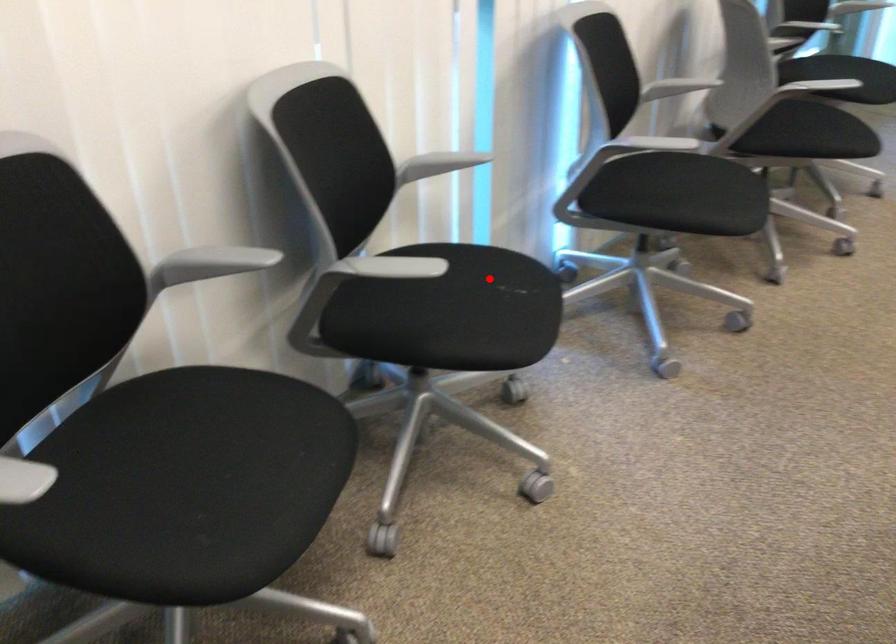
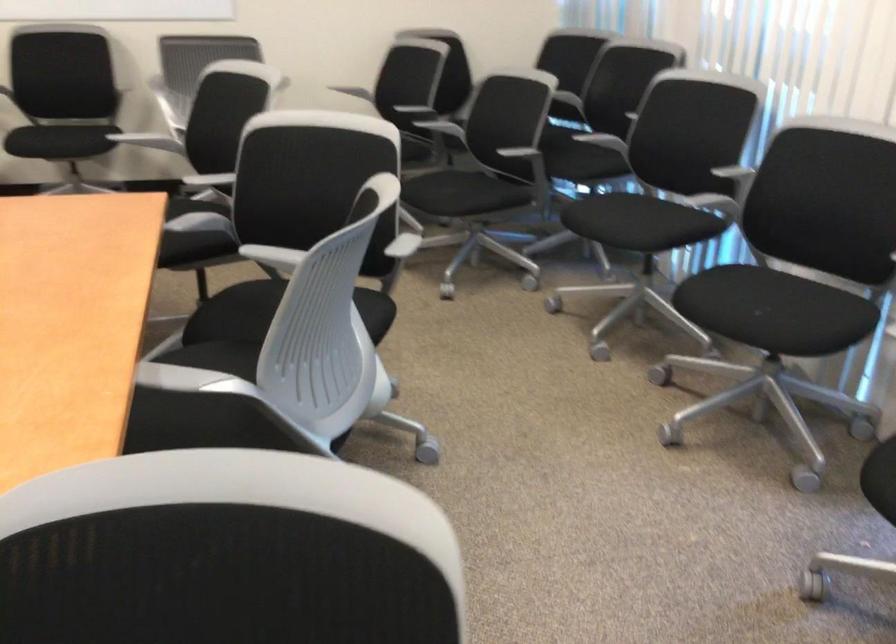
Question: I am providing you with two images of the same scene from different viewpoints. In image1, a red point is highlighted. Considering the same 3D point in image2, which of the following is correct?

Choices:
 (A) It is closer
 (B) It is farther

Answer: (B)